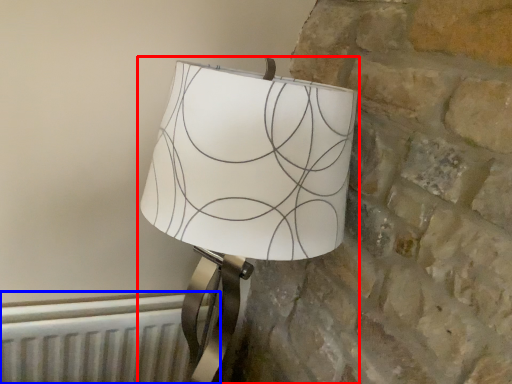
Question: Which object appears farthest to the camera in this image, lamp (highlighted by a red box) or radiator (highlighted by a blue box)?

Choices:
 (A) lamp
 (B) radiator

Answer: (B)